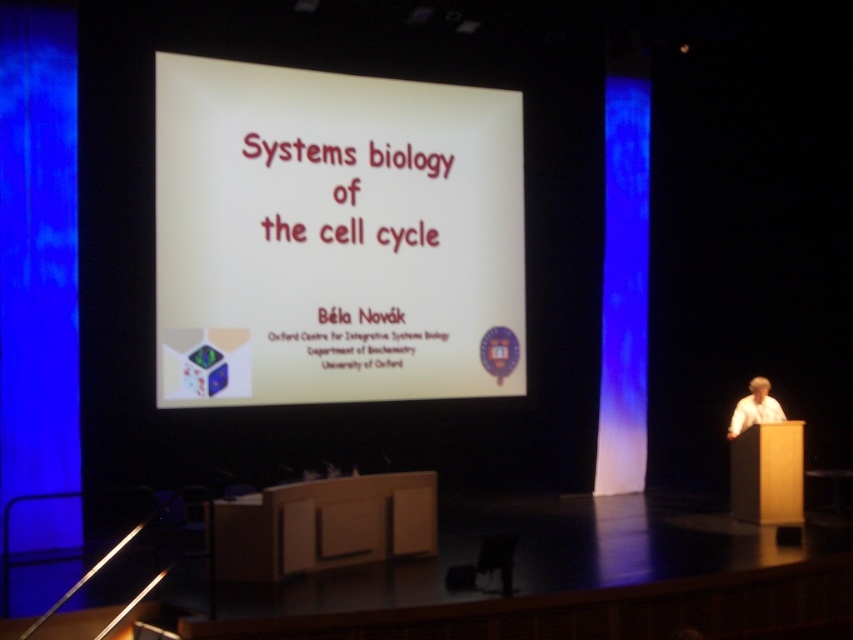
In the scene shown: You are organizing a conference and need to place two white papers on a table. The white paper at center and the white paper at right must be arranged so that the larger one is on the left side of the table. Based on the scene description, which white paper should be placed on the left?

The white paper at center should be placed on the left side of the table because it has a larger size compared to the white paper at right.

You are an attendee at the presentation and need to refer to both the white paper at center and the white paper at right. Which one is positioned higher on the screen?

The white paper at center is located above the white paper at right, so it is positioned higher on the screen.